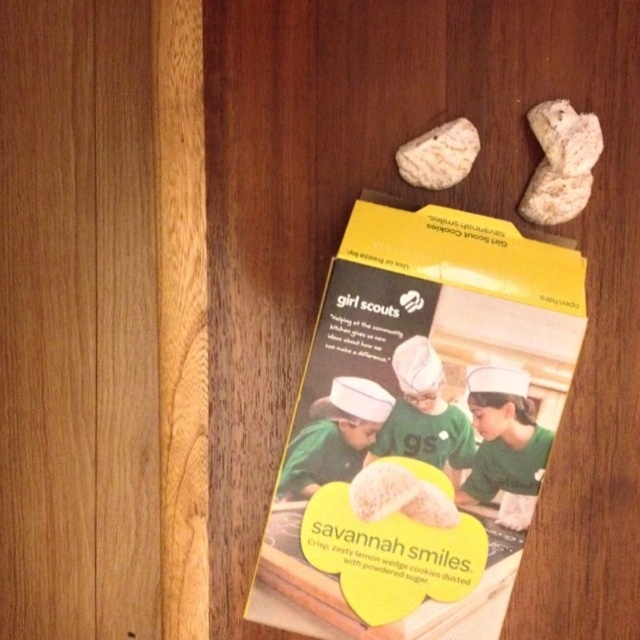
Is yellow paper girl scout cookie box at center wider than white crumbly cookie at center?

Indeed, yellow paper girl scout cookie box at center has a greater width compared to white crumbly cookie at center.

Does yellow paper girl scout cookie box at center have a lesser width compared to white crumbly cookie at center?

No.

This screenshot has width=640, height=640. Identify the location of yellow paper girl scout cookie box at center. (419, 426).

Can you confirm if baked white cookie at upper center is wider than white crumbly cookie at upper right?

Indeed, baked white cookie at upper center has a greater width compared to white crumbly cookie at upper right.

Based on the photo, who is shorter, baked white cookie at upper center or white crumbly cookie at upper right?

Standing shorter between the two is baked white cookie at upper center.

Locate an element on the screen. The width and height of the screenshot is (640, 640). baked white cookie at upper center is located at coordinates (438, 156).

Is point (449, 497) more distant than point (589, 132)?

Yes.

Is white crumbly cookie at center wider than white crumbly cookie at upper right?

Yes.

What do you see at coordinates (400, 496) in the screenshot? The height and width of the screenshot is (640, 640). I see `white crumbly cookie at center` at bounding box center [400, 496].

Where is `white crumbly cookie at center`? The height and width of the screenshot is (640, 640). white crumbly cookie at center is located at coordinates (400, 496).